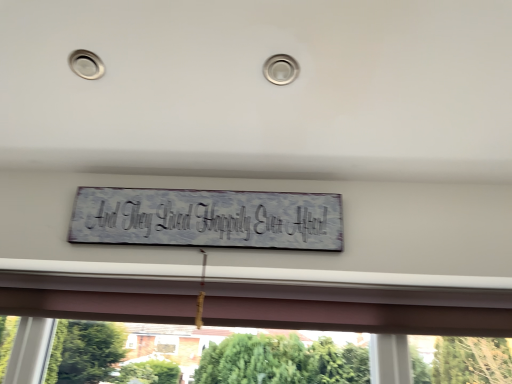
Identify the location of white distressed wood sign at center. (207, 218).

What do you see at coordinates (207, 218) in the screenshot? I see `white distressed wood sign at center` at bounding box center [207, 218].

In order to face transparent glass window at center, should I rotate leftwards or rightwards?

Turn left by 1.233 degrees to look at transparent glass window at center.

What is the approximate width of transparent glass window at center?

transparent glass window at center is 2.49 inches wide.

What do you see at coordinates (362, 306) in the screenshot?
I see `transparent glass window at center` at bounding box center [362, 306].

You are a GUI agent. You are given a task and a screenshot of the screen. Output one action in this format:
    pyautogui.click(x=<x>, y=<y>)
    Task: Click on the transparent glass window at center
    
    Given the screenshot: What is the action you would take?
    pyautogui.click(x=362, y=306)

I want to click on white distressed wood sign at center, so click(207, 218).

Based on the photo, considering the positions of objects white distressed wood sign at center and transparent glass window at center in the image provided, who is more to the right, white distressed wood sign at center or transparent glass window at center?

Positioned to the right is transparent glass window at center.

Which object is closer to the camera taking this photo, white distressed wood sign at center or transparent glass window at center?

white distressed wood sign at center is more forward.

Considering the points (286, 204) and (487, 314), which point is in front, point (286, 204) or point (487, 314)?

Positioned in front is point (286, 204).

From the image's perspective, is white distressed wood sign at center located above transparent glass window at center?

Yes.

From a real-world perspective, does white distressed wood sign at center sit lower than transparent glass window at center?

No.

Looking at this image, in terms of width, does white distressed wood sign at center look wider or thinner when compared to transparent glass window at center?

white distressed wood sign at center is thinner than transparent glass window at center.

From their relative heights in the image, would you say white distressed wood sign at center is taller or shorter than transparent glass window at center?

In the image, white distressed wood sign at center appears to be shorter than transparent glass window at center.

Consider the image. In terms of size, does white distressed wood sign at center appear bigger or smaller than transparent glass window at center?

Clearly, white distressed wood sign at center is smaller in size than transparent glass window at center.

Is white distressed wood sign at center positioned beyond the bounds of transparent glass window at center?

Yes, white distressed wood sign at center is located beyond the bounds of transparent glass window at center.

Is white distressed wood sign at center not near transparent glass window at center?

No, white distressed wood sign at center is not far away from transparent glass window at center.

Is white distressed wood sign at center oriented away from transparent glass window at center?

No, white distressed wood sign at center's orientation is not away from transparent glass window at center.

How much distance is there between white distressed wood sign at center and transparent glass window at center?

A distance of 27.21 centimeters exists between white distressed wood sign at center and transparent glass window at center.

In order to click on window behind the white distressed wood sign at center in this screenshot , I will do `click(362, 306)`.

Considering the relative positions of transparent glass window at center and white distressed wood sign at center in the image provided, is transparent glass window at center to the left of white distressed wood sign at center from the viewer's perspective?

In fact, transparent glass window at center is to the right of white distressed wood sign at center.

Is the position of transparent glass window at center more distant than that of white distressed wood sign at center?

Yes, transparent glass window at center is behind white distressed wood sign at center.

Considering the positions of points (109, 319) and (281, 235), is point (109, 319) closer to camera compared to point (281, 235)?

No.

From the image's perspective, is transparent glass window at center under white distressed wood sign at center?

Yes, from the image's perspective, transparent glass window at center is below white distressed wood sign at center.

From a real-world perspective, which is physically below, transparent glass window at center or white distressed wood sign at center?

transparent glass window at center is physically lower.

Which of these two, transparent glass window at center or white distressed wood sign at center, is thinner?

Thinner between the two is white distressed wood sign at center.

Who is shorter, transparent glass window at center or white distressed wood sign at center?

white distressed wood sign at center.

Can you confirm if transparent glass window at center is smaller than white distressed wood sign at center?

No.

Consider the image. Is transparent glass window at center inside the boundaries of white distressed wood sign at center, or outside?

transparent glass window at center is outside white distressed wood sign at center.

Is transparent glass window at center not close to white distressed wood sign at center?

No.

Is transparent glass window at center oriented towards white distressed wood sign at center?

No, transparent glass window at center does not turn towards white distressed wood sign at center.

How distant is transparent glass window at center from white distressed wood sign at center?

transparent glass window at center is 10.71 inches away from white distressed wood sign at center.

You are a GUI agent. You are given a task and a screenshot of the screen. Output one action in this format:
    pyautogui.click(x=<x>, y=<y>)
    Task: Click on the window below the white distressed wood sign at center (from the image's perspective)
    This screenshot has height=384, width=512.
    Given the screenshot: What is the action you would take?
    pyautogui.click(x=362, y=306)

Image resolution: width=512 pixels, height=384 pixels. I want to click on sign above the transparent glass window at center (from a real-world perspective), so click(207, 218).

Locate an element on the screen. This screenshot has width=512, height=384. sign on the left of transparent glass window at center is located at coordinates (207, 218).